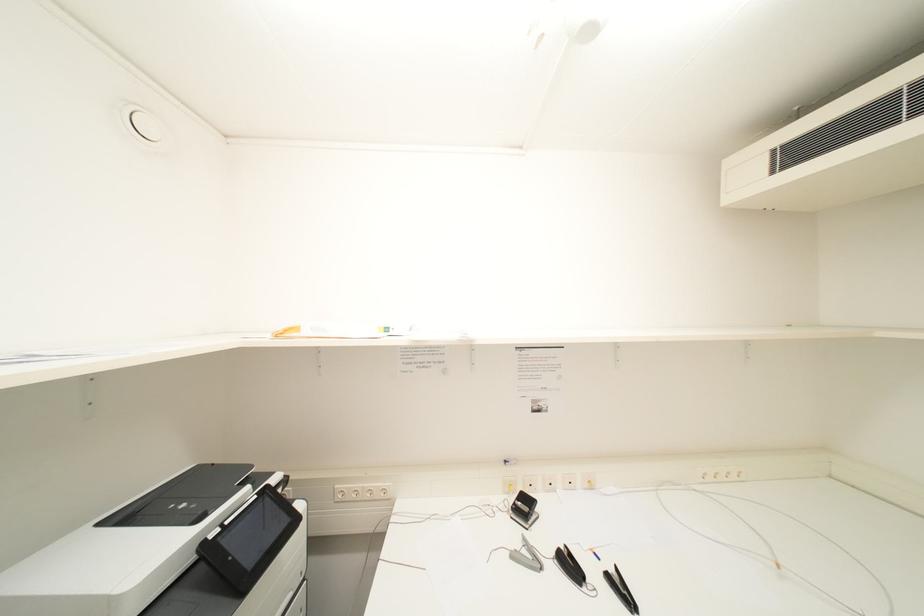
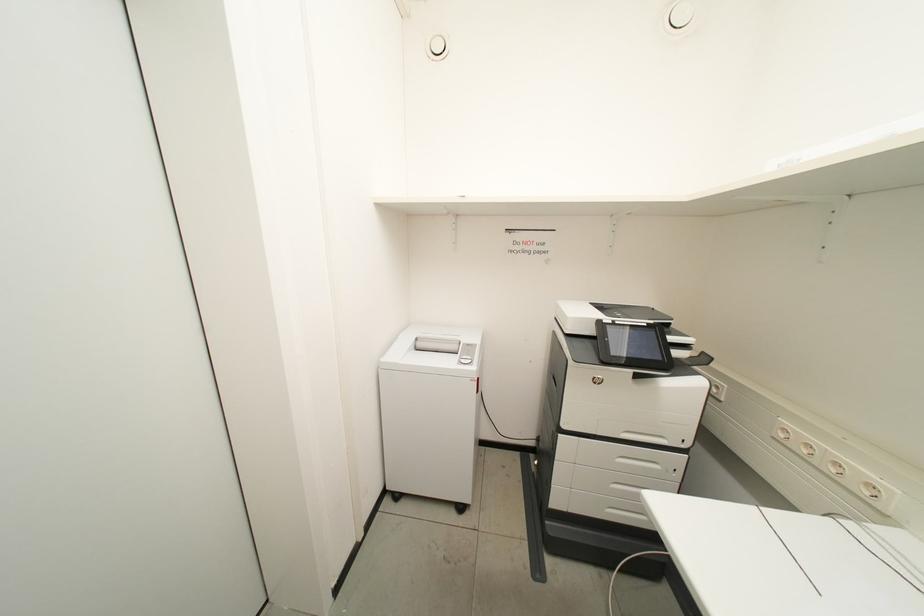
Question: Based on the continuous images, in which direction is the camera rotating? Reply with the corresponding letter.

Choices:
 (A) Left
 (B) Right
 (C) Up
 (D) Down

Answer: (A)